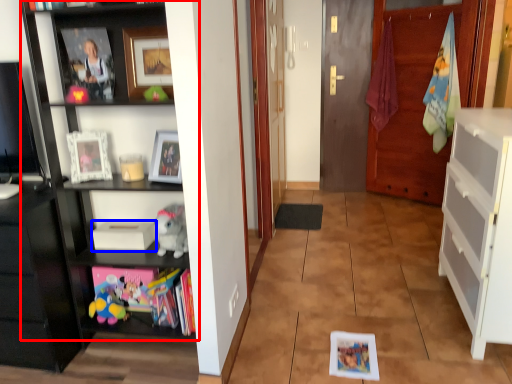
Question: Which point is closer to the camera, shelf (highlighted by a red box) or book (highlighted by a blue box)?

Choices:
 (A) shelf
 (B) book

Answer: (A)